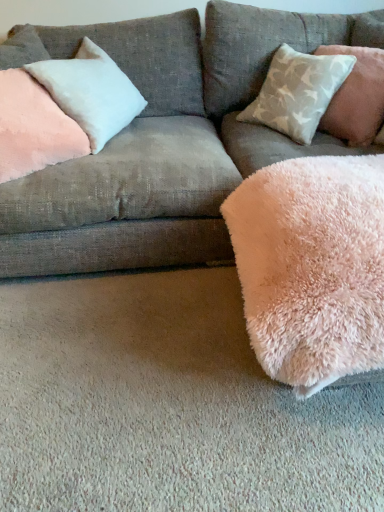
Question: Considering the positions of pink plush pillow at upper left, which appears as the first pillow when viewed from the left, and light gray textured pillow at upper right, which is the 3th pillow from left to right, in the image, is pink plush pillow at upper left, which appears as the first pillow when viewed from the left, wider or thinner than light gray textured pillow at upper right, which is the 3th pillow from left to right,?

Choices:
 (A) thin
 (B) wide

Answer: (A)

Question: From a real-world perspective, is pink plush pillow at upper left, the 3th pillow when ordered from right to left, positioned above or below light gray textured pillow at upper right, which appears as the first pillow when viewed from the right?

Choices:
 (A) below
 (B) above

Answer: (B)

Question: Considering the real-world distances, which object is farthest from the velvet pink pillow at upper left?

Choices:
 (A) fluffy pink blanket at lower right
 (B) satin white pillow at upper left, positioned as the 2th pillow in right-to-left order
 (C) light gray textured pillow at upper right, which appears as the first pillow when viewed from the right
 (D) pink plush pillow at upper left, which appears as the first pillow when viewed from the left

Answer: (C)

Question: Based on their relative distances, which object is nearer to the pink plush pillow at upper left, which appears as the first pillow when viewed from the left?

Choices:
 (A) light gray textured pillow at upper right, which appears as the first pillow when viewed from the right
 (B) fluffy pink blanket at lower right
 (C) velvet pink pillow at upper left
 (D) satin white pillow at upper left, arranged as the 2th pillow when viewed from the left

Answer: (D)